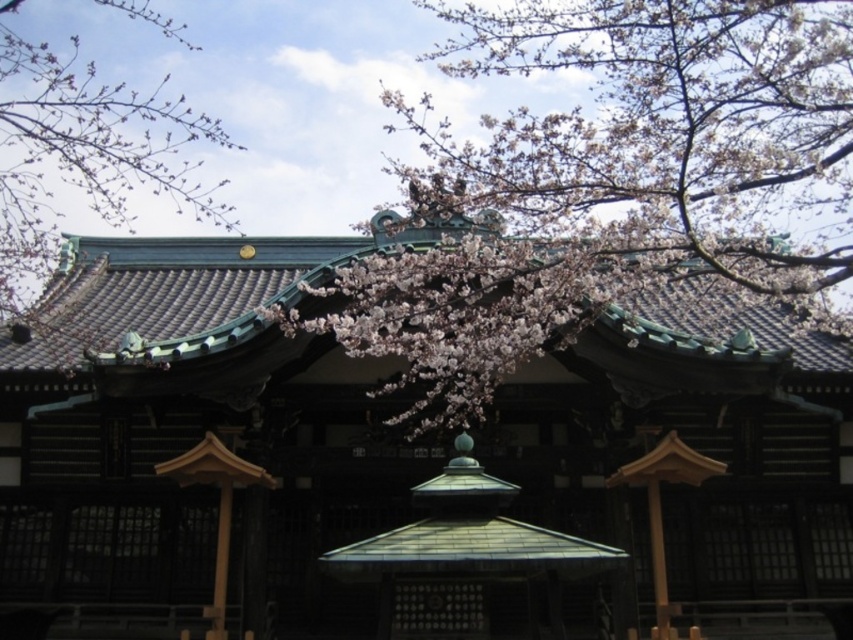
Question: Can you confirm if pink blossom at center is bigger than pink blossoms at upper left?

Choices:
 (A) yes
 (B) no

Answer: (A)

Question: Does pink blossom at center appear over pink blossoms at upper left?

Choices:
 (A) yes
 (B) no

Answer: (A)

Question: Which of the following is the closest to the observer?

Choices:
 (A) (762, 172)
 (B) (84, 168)

Answer: (A)

Question: Which point appears closest to the camera in this image?

Choices:
 (A) (791, 13)
 (B) (169, 32)

Answer: (A)

Question: Among these objects, which one is nearest to the camera?

Choices:
 (A) pink blossoms at upper left
 (B) pink blossom at center

Answer: (B)

Question: Can you confirm if pink blossom at center is positioned above pink blossoms at upper left?

Choices:
 (A) yes
 (B) no

Answer: (A)